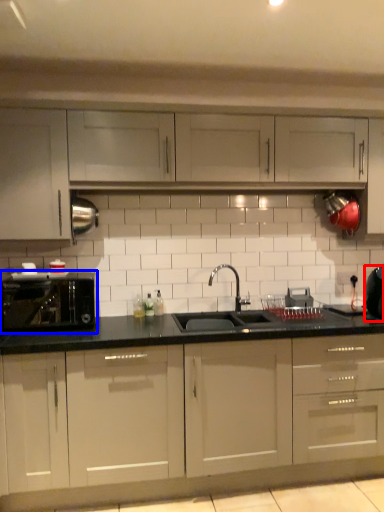
Question: Which object appears farthest to the camera in this image, appliance (highlighted by a red box) or home appliance (highlighted by a blue box)?

Choices:
 (A) appliance
 (B) home appliance

Answer: (A)